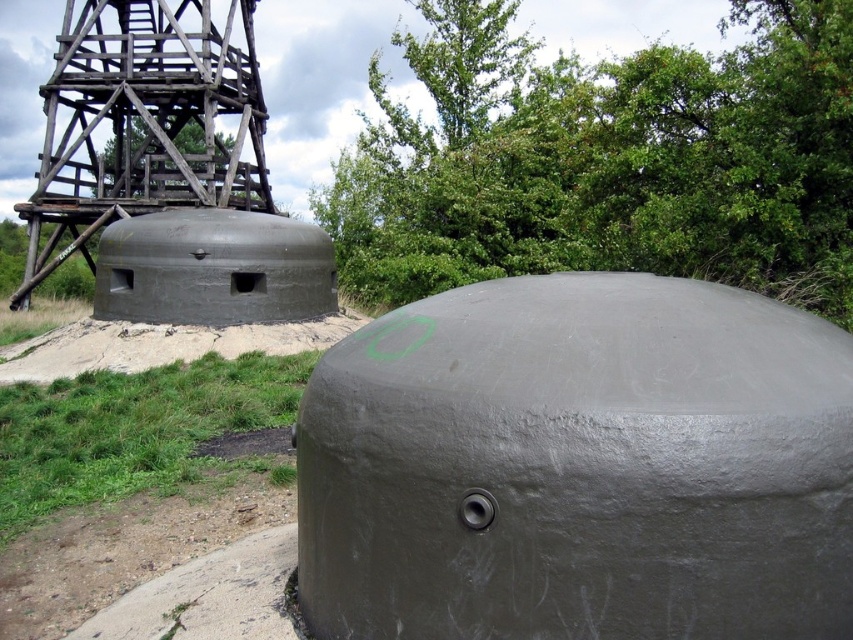
Describe the element at coordinates (579, 467) in the screenshot. I see `gray concrete dome at center` at that location.

Can you confirm if gray concrete dome at center is taller than gray concrete turret at center?

No.

Is point (463, 352) behind point (68, 227)?

No, it is in front of (68, 227).

Identify the location of gray concrete dome at center. (579, 467).

Can you confirm if gray concrete dome at center is shorter than gray concrete at lower left?

No, gray concrete dome at center is not shorter than gray concrete at lower left.

Is point (706, 636) less distant than point (252, 560)?

Yes, point (706, 636) is in front of point (252, 560).

This screenshot has height=640, width=853. Find the location of `gray concrete dome at center`. gray concrete dome at center is located at coordinates (579, 467).

Which is behind, point (28, 209) or point (138, 636)?

Positioned behind is point (28, 209).

Identify the location of gray concrete turret at center. The image size is (853, 640). (144, 124).